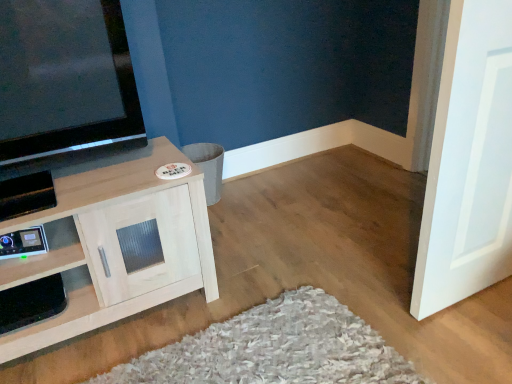
Find the location of a particular element. This screenshot has width=512, height=384. vacant area that lies to the right of light wood cabinet at left is located at coordinates (254, 292).